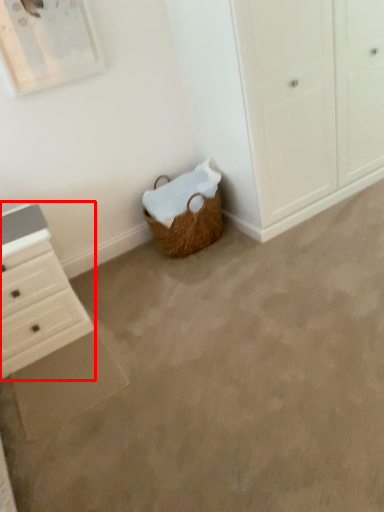
Question: From the image's perspective, what is the correct spatial positioning of chest of drawers (annotated by the red box) in reference to concrete?

Choices:
 (A) below
 (B) above

Answer: (B)